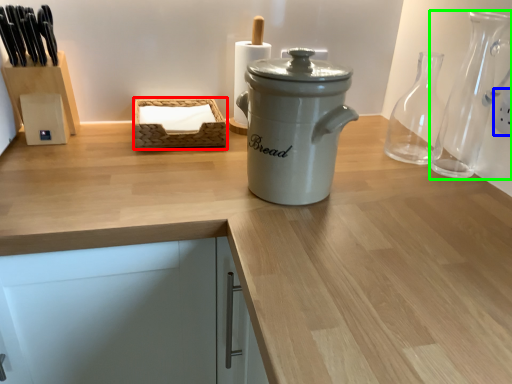
Question: Based on their relative distances, which object is nearer to basket (highlighted by a red box)? Choose from electric outlet (highlighted by a blue box) and glass vase (highlighted by a green box).

Choices:
 (A) electric outlet
 (B) glass vase

Answer: (B)